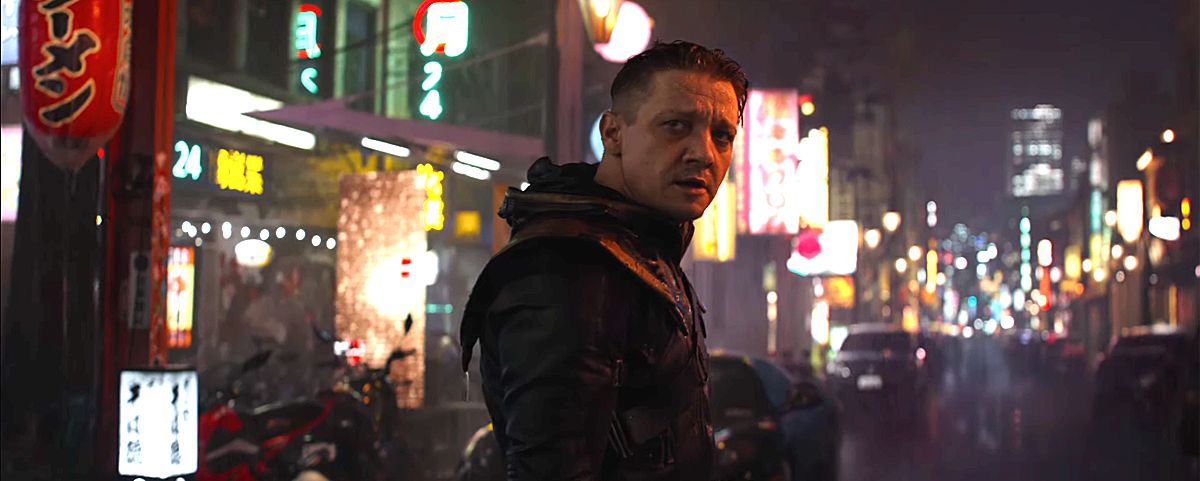
This screenshot has height=481, width=1200. What are the coordinates of `white lanturn` in the screenshot? It's located at (x=160, y=439).